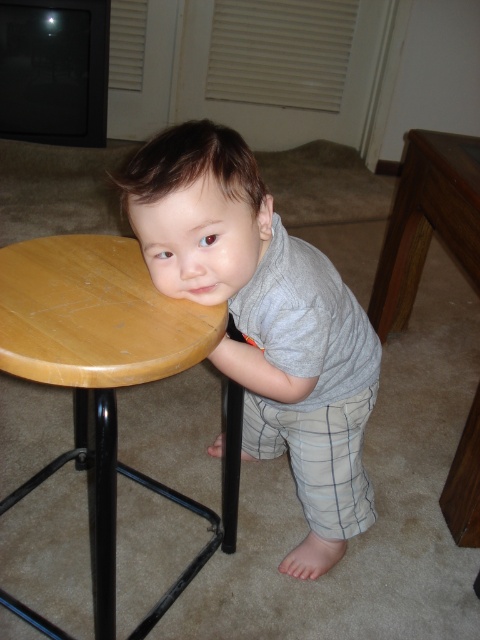
In the scene shown: You are a parent looking for your child in a room. You see the gray cotton shirt at center and the wooden round table at lower left. Which object is closer to the right side of the room?

The gray cotton shirt at center is closer to the right side of the room because it is to the right of the wooden round table at lower left.

You are standing in the living room and see two points on the floor. The first point is at coordinate point (24, 248) and the second is at coordinate point (13, 324). If you want to walk from the first point to the second point, which direction should you face?

To walk from point (24, 248) to point (13, 324), you should face towards the direction where the second point is located. Since point (24, 248) is behind point (13, 324), you would need to move forward towards the second point.

You are trying to place a large potted plant between the wooden round table at lower left and the wooden table at right. Which table should the plant be placed closer to if you want it centered between them?

The wooden round table at lower left might be wider than the wooden table at right, so to center the plant between them, it should be placed closer to the wooden table at right to account for the difference in width.